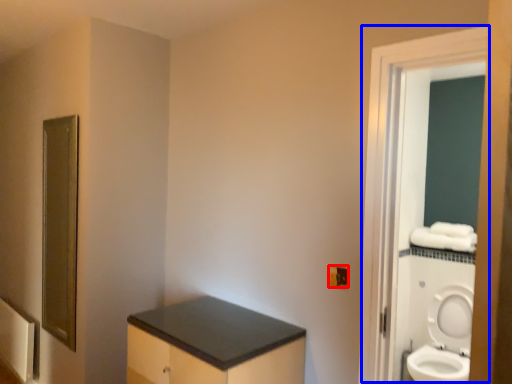
Question: Which point is further to the camera, electric outlet (highlighted by a red box) or screen door (highlighted by a blue box)?

Choices:
 (A) electric outlet
 (B) screen door

Answer: (A)